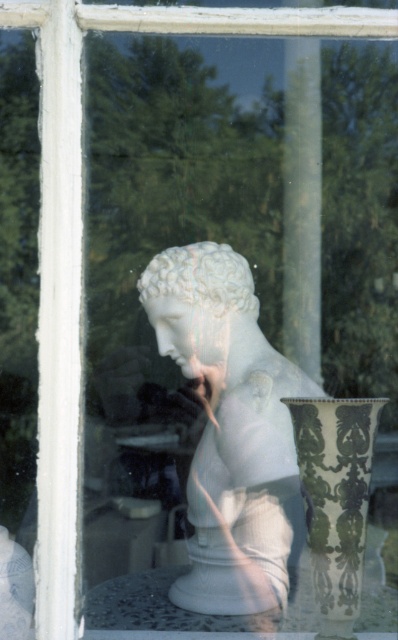
You are an interior designer arranging items on a shelf. You have a green and white ceramic vase at center and a white marble vase at lower center. You need to place them exactly 6 inches apart. Can you fit both on a shelf that is 12 inches wide?

The green and white ceramic vase at center is 5.02 inches away from the white marble vase at lower center. Since the total space they occupy is 5.02 inches, which is less than 12 inches, yes, both can fit on the 12 inch wide shelf.

You are an art student observing the scene. You need to determine the relative positions of the white marble bust at center and the green and white ceramic vase at center. Which object is located to the left of the other?

The white marble bust at center is positioned on the left side of the green and white ceramic vase at center.

What is the relationship in size between the green and white ceramic vase at center and the white marble vase at lower center?

The green and white ceramic vase at center is smaller than the white marble vase at lower center.